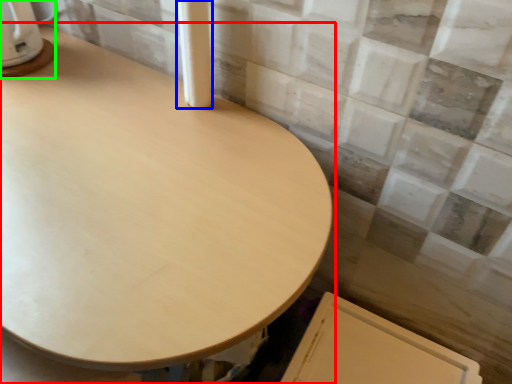
Question: Considering the real-world distances, which object is farthest from table (highlighted by a red box)? pillar (highlighted by a blue box) or appliance (highlighted by a green box)?

Choices:
 (A) pillar
 (B) appliance

Answer: (B)